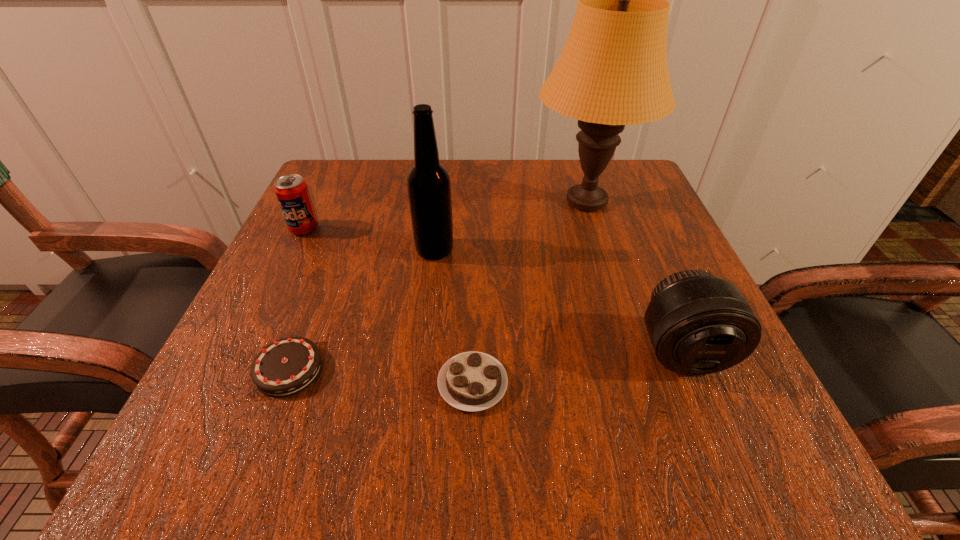
Find the location of `free area in between the right chocolate cake and the left chocolate cake`. free area in between the right chocolate cake and the left chocolate cake is located at coordinates (381, 377).

Identify the location of empty location between the soda can and the third tallest object. (493, 290).

At what (x,y) coordinates should I click in order to perform the action: click on free space between the third tallest object and the right chocolate cake. Please return your answer as a coordinate pair (x, y). Looking at the image, I should click on (578, 367).

Where is `blank region between the right chocolate cake and the fourth shortest object`? This screenshot has height=540, width=960. blank region between the right chocolate cake and the fourth shortest object is located at coordinates (578, 367).

Identify the location of free space between the tallest object and the third tallest object. The height and width of the screenshot is (540, 960). (635, 276).

I want to click on object that ranks as the fifth closest to the soda can, so click(x=698, y=324).

Locate an element on the screen. The height and width of the screenshot is (540, 960). object that stands as the fourth closest to the second tallest object is located at coordinates (472, 381).